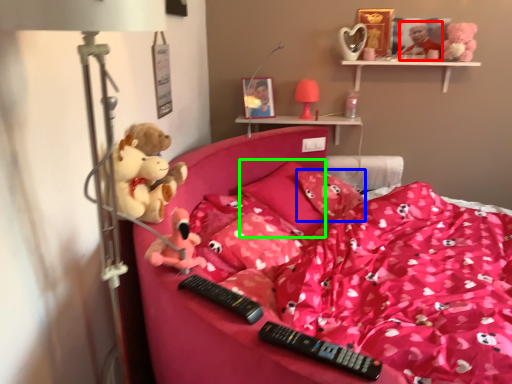
Question: Which object is the closest to the toy (highlighted by a red box)? Choose among these: pillow (highlighted by a blue box) or pillow (highlighted by a green box).

Choices:
 (A) pillow
 (B) pillow

Answer: (A)